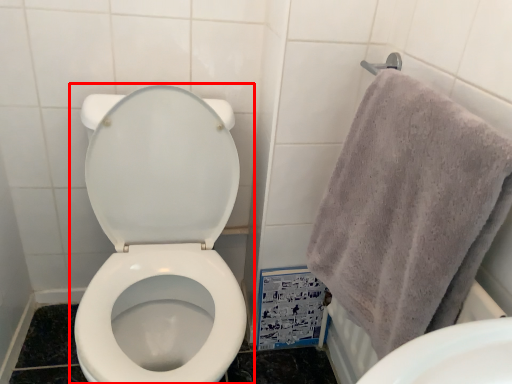
Question: From the image, what is the correct spatial relationship of toilet (annotated by the red box) in relation to towel?

Choices:
 (A) right
 (B) left

Answer: (B)